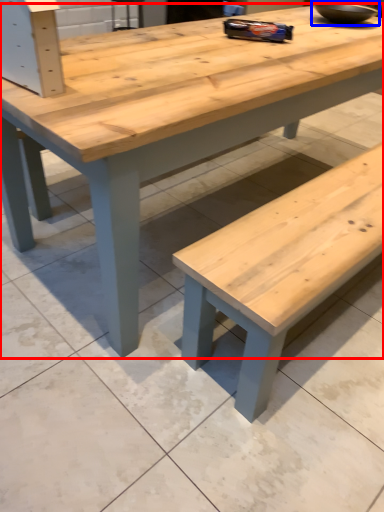
Question: Which object is further to the camera taking this photo, table (highlighted by a red box) or bowl (highlighted by a blue box)?

Choices:
 (A) table
 (B) bowl

Answer: (B)